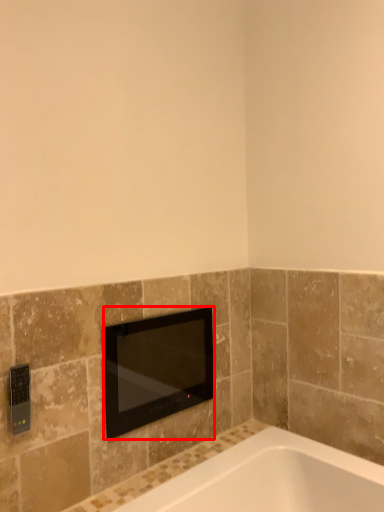
Question: From the image's perspective, where is television (annotated by the red box) located relative to light switch?

Choices:
 (A) below
 (B) above

Answer: (A)